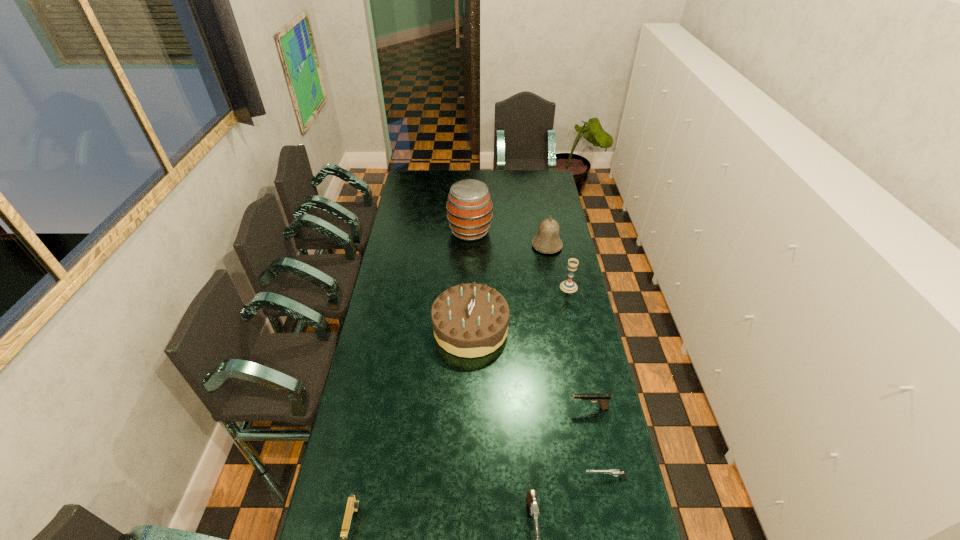
Locate an element on the screen. free space at the left edge of the desktop is located at coordinates (399, 309).

The width and height of the screenshot is (960, 540). In the image, there is a desktop. In order to click on vacant space at the right edge in this screenshot , I will do `click(572, 279)`.

Where is `unoccupied position between the fourth farthest object and the fourth nearest object`? unoccupied position between the fourth farthest object and the fourth nearest object is located at coordinates (530, 368).

The image size is (960, 540). I want to click on blank region between the tallest object and the sixth farthest object, so click(538, 355).

Where is `free space between the tallest object and the fifth farthest object`? free space between the tallest object and the fifth farthest object is located at coordinates (530, 320).

Where is `free point between the cider and the chalice`? The image size is (960, 540). free point between the cider and the chalice is located at coordinates (519, 259).

The height and width of the screenshot is (540, 960). Find the location of `object that is the third closest to the chalice`. object that is the third closest to the chalice is located at coordinates (469, 207).

I want to click on object that stands as the seventh closest to the fifth object from right to left, so click(x=469, y=207).

I want to click on pistol that is the second nearest to the fourth nearest object, so 531,494.

Identify which pistol is the second closest to the fourth nearest object. Please provide its 2D coordinates. Your answer should be formatted as a tuple, i.e. [(x, y)], where the tuple contains the x and y coordinates of a point satisfying the conditions above.

[(531, 494)]